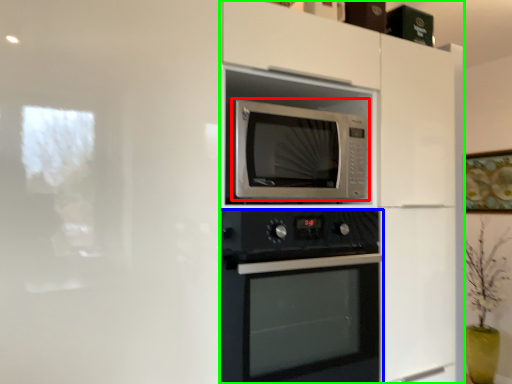
Question: Estimate the real-world distances between objects in this image. Which object is closer to microwave oven (highlighted by a red box), oven (highlighted by a blue box) or dresser (highlighted by a green box)?

Choices:
 (A) oven
 (B) dresser

Answer: (B)